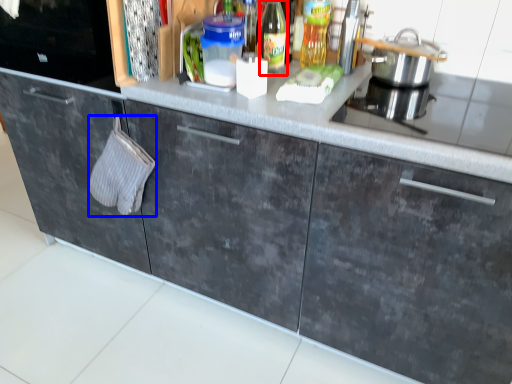
Question: Which point is closer to the camera, bottle (highlighted by a red box) or hand towel (highlighted by a blue box)?

Choices:
 (A) bottle
 (B) hand towel

Answer: (A)